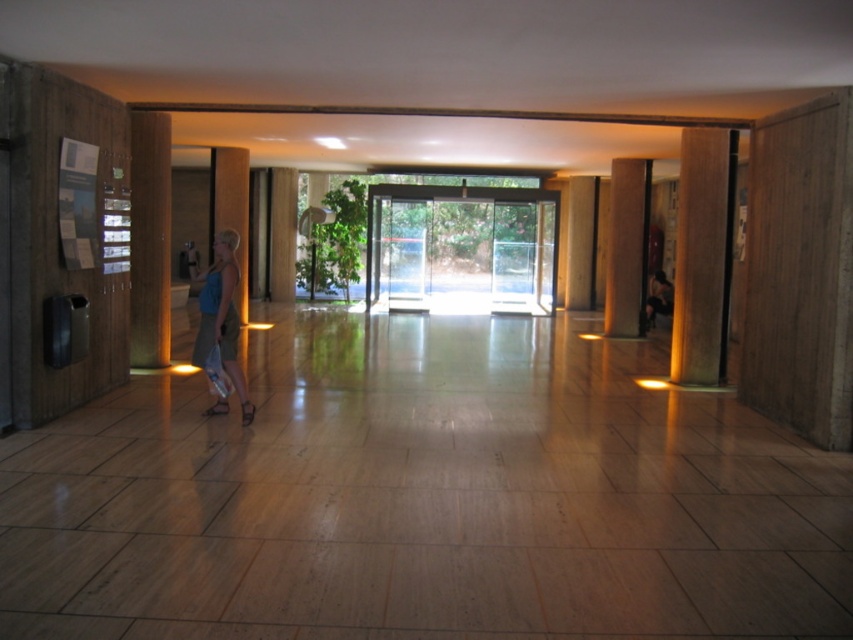
Does transparent glass door at center have a greater height compared to brown polished wood pillar at center?

Incorrect, transparent glass door at center's height is not larger of brown polished wood pillar at center's.

At what (x,y) coordinates should I click in order to perform the action: click on transparent glass door at center. Please return your answer as a coordinate pair (x, y). Looking at the image, I should click on (461, 248).

Where is `transparent glass door at center`? Image resolution: width=853 pixels, height=640 pixels. transparent glass door at center is located at coordinates (x=461, y=248).

Is transparent glass door at center positioned behind matte concrete pillar at center?

Yes, it is.

Who is more forward, [369,291] or [245,196]?

Point [245,196]

The height and width of the screenshot is (640, 853). What are the coordinates of `transparent glass door at center` in the screenshot? It's located at (461, 248).

Is point (515, 284) farther from viewer compared to point (204, 321)?

Yes, it is behind point (204, 321).

Which is in front, point (553, 260) or point (247, 420)?

Point (247, 420) is more forward.

You are a GUI agent. You are given a task and a screenshot of the screen. Output one action in this format:
    pyautogui.click(x=<x>, y=<y>)
    Task: Click on the transparent glass door at center
    
    Given the screenshot: What is the action you would take?
    pyautogui.click(x=461, y=248)